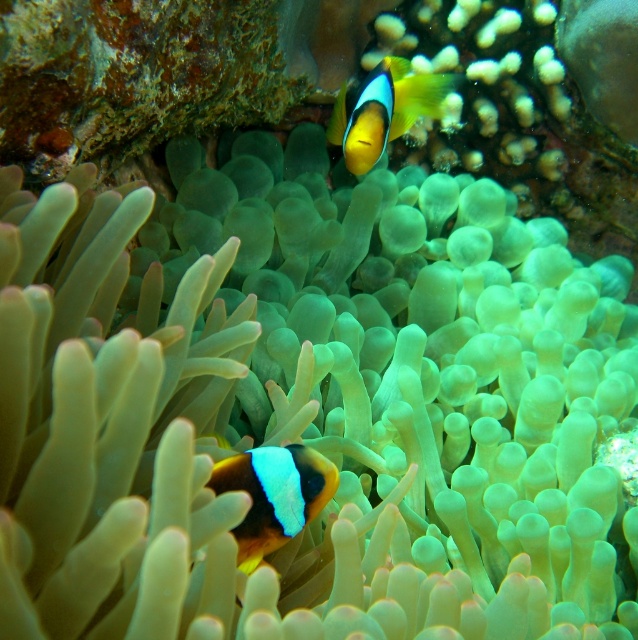
Question: Can you confirm if orange and white clownfish at center is thinner than yellow matte clownfish at upper center?

Choices:
 (A) no
 (B) yes

Answer: (B)

Question: Does orange and white clownfish at center appear over yellow matte clownfish at upper center?

Choices:
 (A) yes
 (B) no

Answer: (B)

Question: Which of the following is the closest to the observer?

Choices:
 (A) yellow matte clownfish at upper center
 (B) orange and white clownfish at center

Answer: (B)

Question: Which of the following is the farthest from the observer?

Choices:
 (A) (396, 131)
 (B) (290, 522)

Answer: (A)

Question: Is orange and white clownfish at center positioned at the back of yellow matte clownfish at upper center?

Choices:
 (A) no
 (B) yes

Answer: (A)